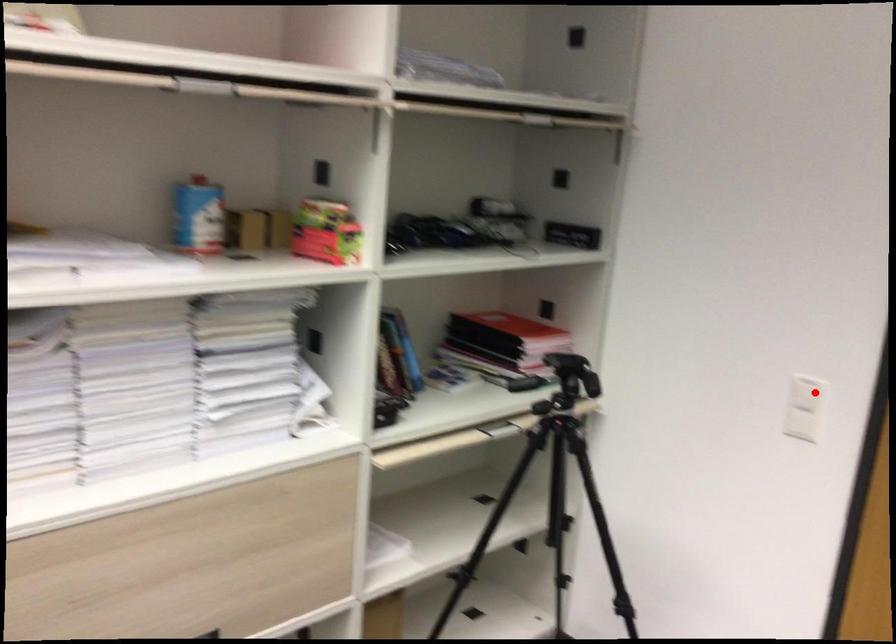
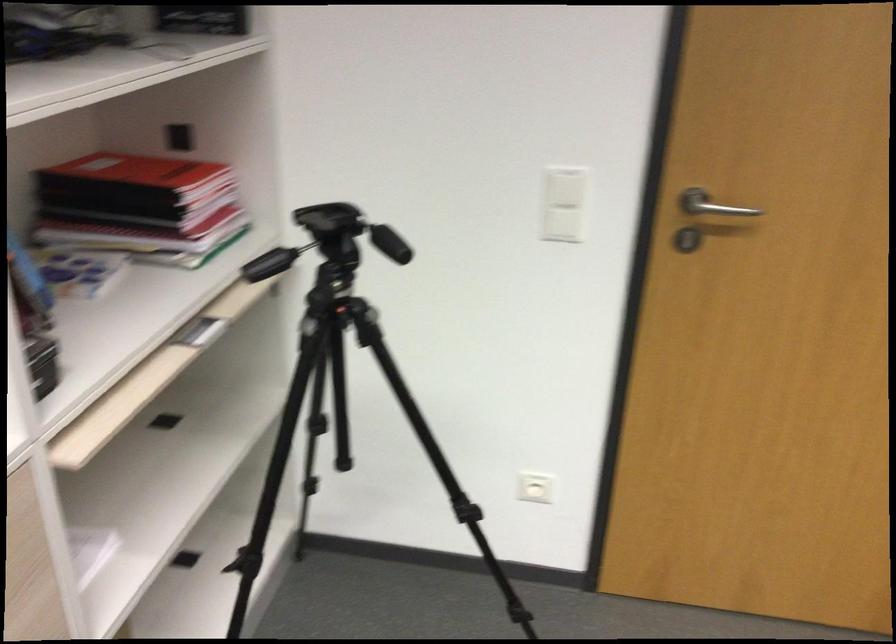
In the second image, find the point that corresponds to the highlighted location in the first image.

(565, 187)